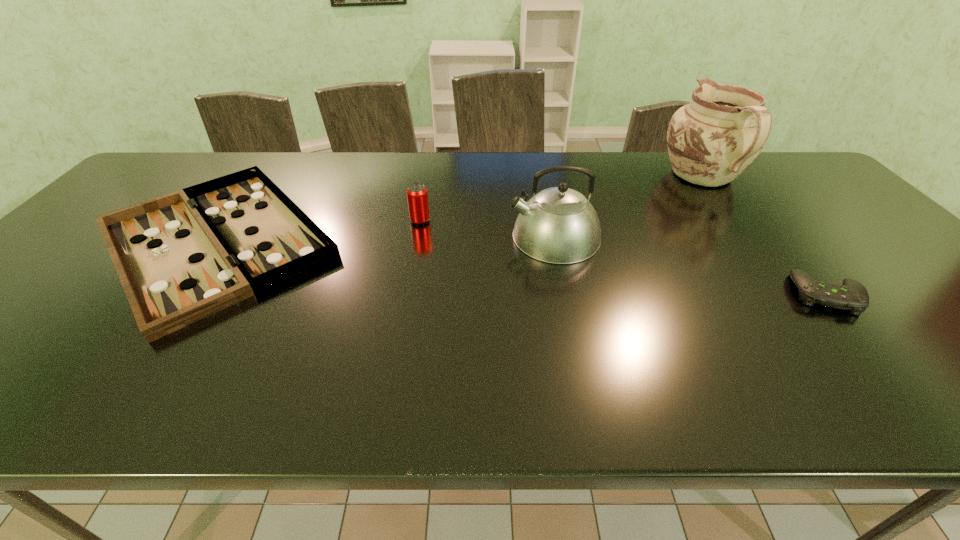
Identify the location of pitcher. (711, 141).

Where is `the fourth shortest object`? the fourth shortest object is located at coordinates (558, 225).

I want to click on kettle, so click(x=558, y=225).

Find the location of `can`. can is located at coordinates (417, 195).

Image resolution: width=960 pixels, height=540 pixels. I want to click on the fourth object from right to left, so click(x=417, y=195).

The width and height of the screenshot is (960, 540). I want to click on control, so click(x=851, y=295).

What are the coordinates of `free region located 0.360m from the spout of the kettle` in the screenshot? It's located at [375, 237].

Locate an element on the screen. This screenshot has width=960, height=540. free space located from the spout of the kettle is located at coordinates (386, 237).

Locate an element on the screen. The height and width of the screenshot is (540, 960). vacant region located 0.300m from the spout of the kettle is located at coordinates (x=397, y=237).

I want to click on vacant region located 0.260m on the left of the can, so click(318, 221).